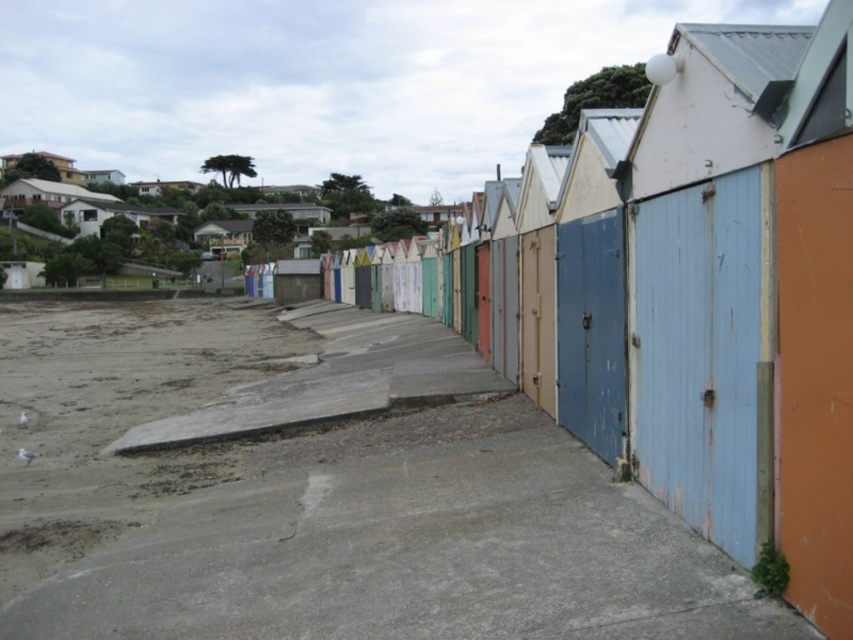
You are standing on the smooth concrete walkway at center and want to reach the gray sandy beach at lower left. Which direction should you move to get there?

To reach the gray sandy beach at lower left from the smooth concrete walkway at center, you should move downward since the walkway is below the beach.

Consider the image. You are a delivery person carrying a large package that is 2 meters wide. You need to move from the residential area in the background to the beach. Which path should you choose between the smooth concrete walkway at center and the gray sandy beach at lower left, and why?

You should choose the gray sandy beach at lower left because its width is greater than the smooth concrete walkway at center, allowing the large 2m wide package to pass safely.